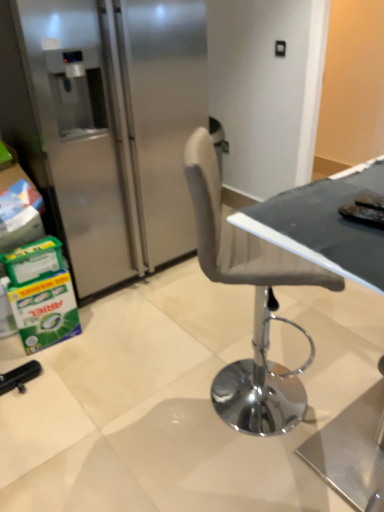
Question: Does matte black table at center appear on the left side of satin silver refrigerator at left?

Choices:
 (A) yes
 (B) no

Answer: (B)

Question: Does matte black table at center have a lesser height compared to satin silver refrigerator at left?

Choices:
 (A) yes
 (B) no

Answer: (A)

Question: Considering the relative sizes of matte black table at center and satin silver refrigerator at left in the image provided, is matte black table at center smaller than satin silver refrigerator at left?

Choices:
 (A) no
 (B) yes

Answer: (B)

Question: Considering the relative sizes of matte black table at center and satin silver refrigerator at left in the image provided, is matte black table at center bigger than satin silver refrigerator at left?

Choices:
 (A) no
 (B) yes

Answer: (A)

Question: Is matte black table at center not near satin silver refrigerator at left?

Choices:
 (A) no
 (B) yes

Answer: (B)

Question: Considering the relative sizes of matte black table at center and satin silver refrigerator at left in the image provided, is matte black table at center taller than satin silver refrigerator at left?

Choices:
 (A) no
 (B) yes

Answer: (A)

Question: Can you confirm if satin silver refrigerator at left is shorter than matte black table at center?

Choices:
 (A) no
 (B) yes

Answer: (A)

Question: Is satin silver refrigerator at left outside matte black table at center?

Choices:
 (A) no
 (B) yes

Answer: (B)

Question: From a real-world perspective, is satin silver refrigerator at left physically below matte black table at center?

Choices:
 (A) no
 (B) yes

Answer: (B)

Question: Can you confirm if satin silver refrigerator at left is bigger than matte black table at center?

Choices:
 (A) no
 (B) yes

Answer: (B)

Question: Can matte black table at center be found inside satin silver refrigerator at left?

Choices:
 (A) yes
 (B) no

Answer: (B)

Question: Can you confirm if satin silver refrigerator at left is positioned to the left of matte black table at center?

Choices:
 (A) yes
 (B) no

Answer: (A)

Question: In the image, is matte black table at center on the left side or the right side of satin silver refrigerator at left?

Choices:
 (A) right
 (B) left

Answer: (A)